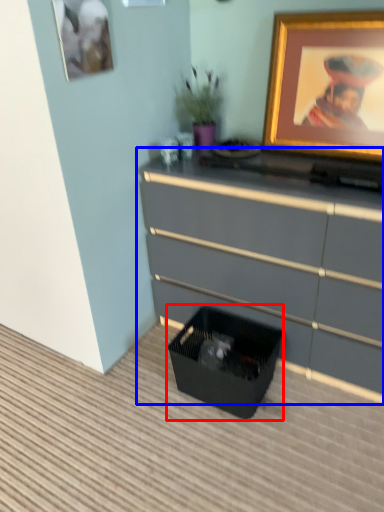
Question: Which point is further to the camera, storage box (highlighted by a red box) or chest of drawers (highlighted by a blue box)?

Choices:
 (A) storage box
 (B) chest of drawers

Answer: (A)